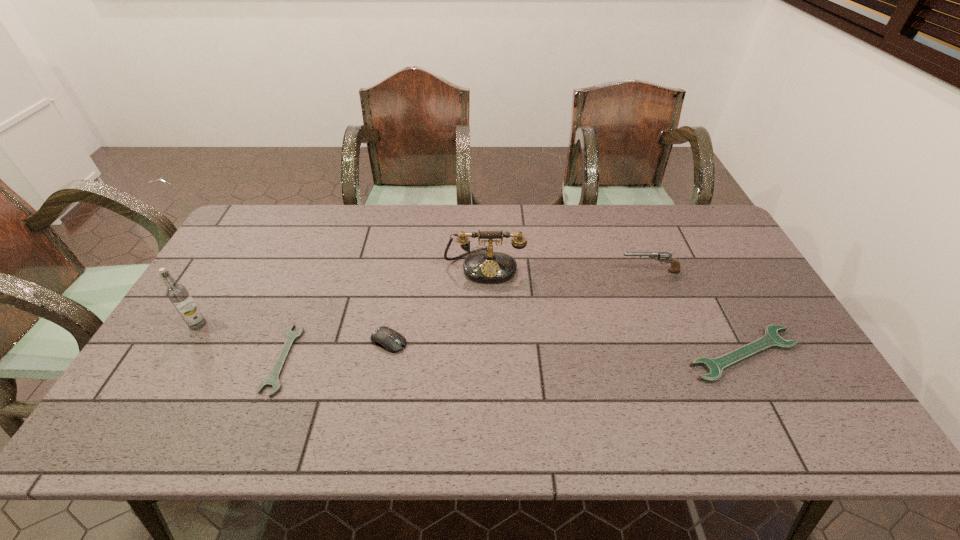
At what (x,y) coordinates should I click in order to perform the action: click on computer equipment. Please return your answer as a coordinate pair (x, y). The height and width of the screenshot is (540, 960). Looking at the image, I should click on (390, 340).

At what (x,y) coordinates should I click in order to perform the action: click on vacant position located 0.280m on the right of the shorter wrench. Please return your answer as a coordinate pair (x, y). Looking at the image, I should click on (403, 360).

Find the location of a particular element. This screenshot has height=540, width=960. free region located 0.250m on the left of the taller wrench is located at coordinates (588, 354).

This screenshot has width=960, height=540. In order to click on vacant space located 0.050m on the dial of the telephone in this screenshot , I will do `click(485, 297)`.

Locate an element on the screen. blank space located aiming along the barrel of the gun is located at coordinates (535, 272).

This screenshot has width=960, height=540. What are the coordinates of `free space located aiming along the barrel of the gun` in the screenshot? It's located at (513, 272).

Identify the location of free point located aiming along the barrel of the gun. (496, 272).

The height and width of the screenshot is (540, 960). In order to click on vacant region located on the label of the tallest object in this screenshot , I will do `click(176, 362)`.

The height and width of the screenshot is (540, 960). In order to click on vacant space located on the front of the fourth tallest object in this screenshot , I will do (377, 402).

I want to click on object that is at the left edge, so click(177, 293).